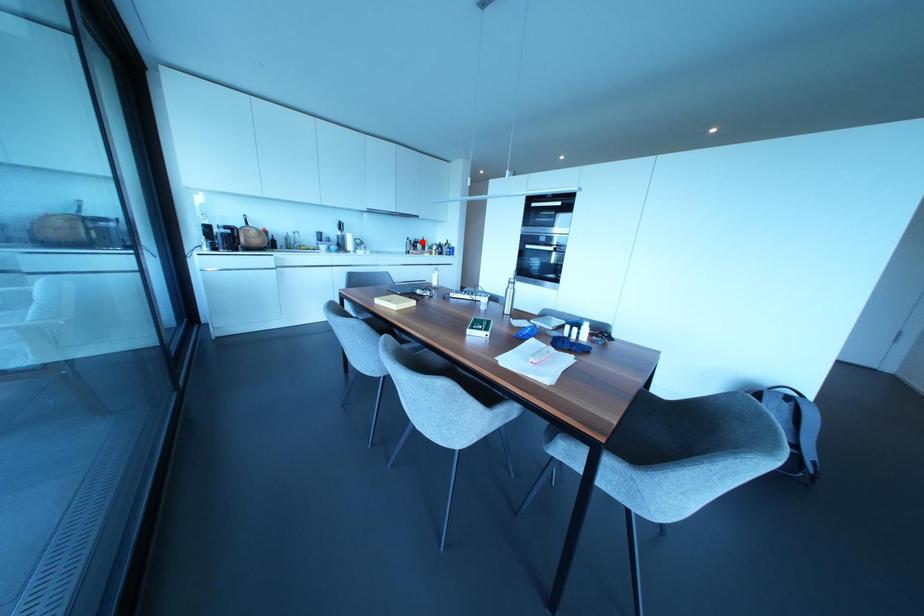
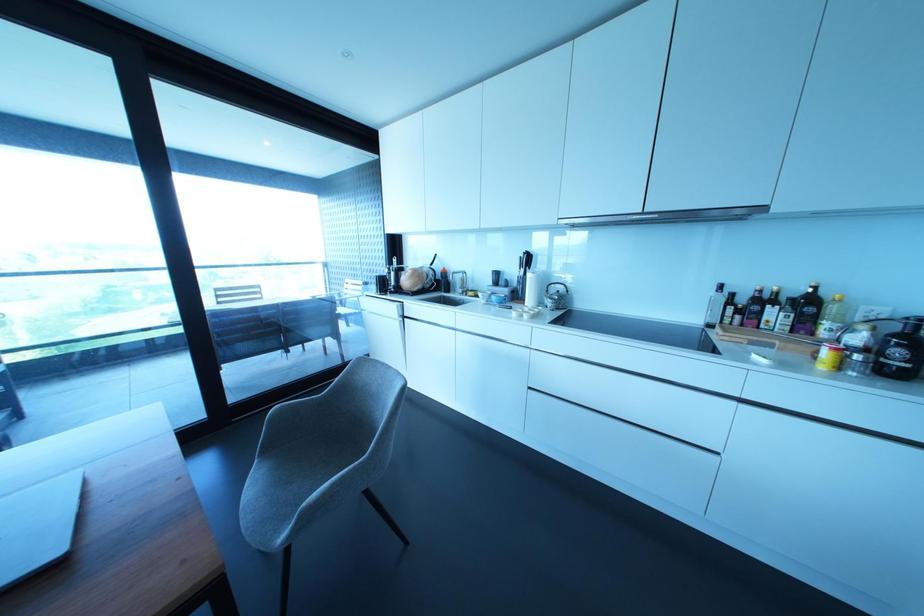
Locate, in the second image, the point that corresponds to the highlighted location in the first image.

(807, 304)